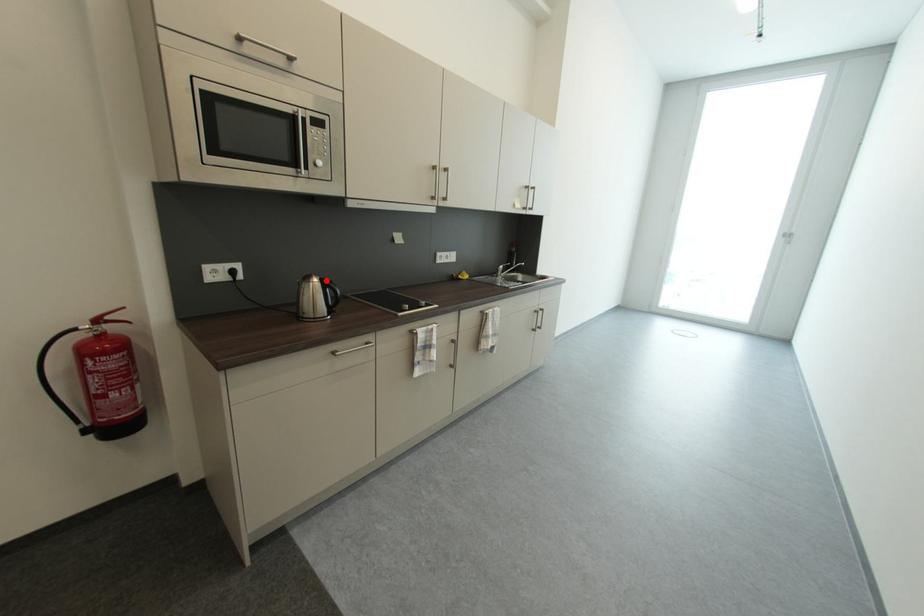
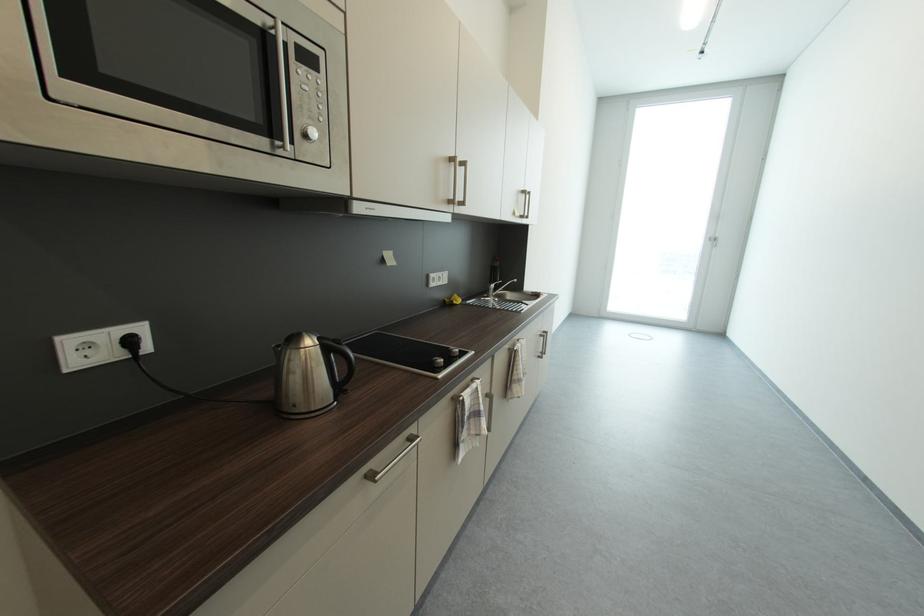
In the second image, find the point that corresponds to the highlighted location in the first image.

(323, 342)